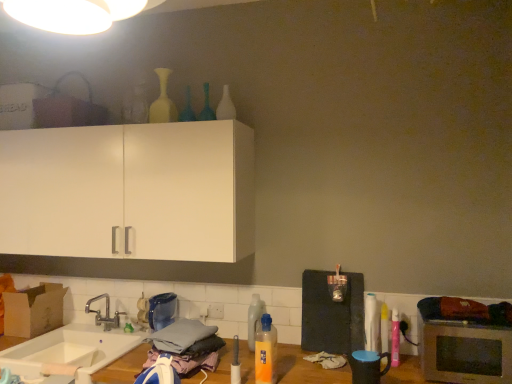
Question: Can you confirm if white ceramic sink at lower left is positioned to the right of matte white vase at upper center, the first bottle from the left?

Choices:
 (A) no
 (B) yes

Answer: (A)

Question: Is the position of white ceramic sink at lower left more distant than that of matte white vase at upper center, which ranks as the eighth bottle in right-to-left order?

Choices:
 (A) no
 (B) yes

Answer: (A)

Question: Does white ceramic sink at lower left have a greater height compared to matte white vase at upper center, the first bottle from the left?

Choices:
 (A) yes
 (B) no

Answer: (B)

Question: Is white ceramic sink at lower left oriented towards matte white vase at upper center, the first bottle from the left?

Choices:
 (A) no
 (B) yes

Answer: (A)

Question: Are white ceramic sink at lower left and matte white vase at upper center, the first bottle from the left, located far from each other?

Choices:
 (A) no
 (B) yes

Answer: (B)

Question: From the image's perspective, is pink plastic spray can at right, the 8th bottle when ordered from left to right, positioned above or below orange translucent bottle at lower center, which appears as the sixth bottle when viewed from the left?

Choices:
 (A) above
 (B) below

Answer: (B)

Question: Is pink plastic spray can at right, which is counted as the first bottle, starting from the right, to the left or to the right of orange translucent bottle at lower center, which appears as the sixth bottle when viewed from the left, in the image?

Choices:
 (A) right
 (B) left

Answer: (A)

Question: In terms of height, does pink plastic spray can at right, which is counted as the first bottle, starting from the right, look taller or shorter compared to orange translucent bottle at lower center, acting as the 3th bottle starting from the right?

Choices:
 (A) tall
 (B) short

Answer: (B)

Question: From a real-world perspective, is pink plastic spray can at right, which is counted as the first bottle, starting from the right, above or below orange translucent bottle at lower center, which appears as the sixth bottle when viewed from the left?

Choices:
 (A) below
 (B) above

Answer: (A)

Question: Is white glossy bottle at right, which is counted as the second bottle, starting from the right, taller or shorter than translucent glass bottle at upper center, positioned as the seventh bottle in right-to-left order?

Choices:
 (A) short
 (B) tall

Answer: (B)

Question: From the image's perspective, is white glossy bottle at right, which is counted as the second bottle, starting from the right, above or below translucent glass bottle at upper center, the 2th bottle viewed from the left?

Choices:
 (A) above
 (B) below

Answer: (B)

Question: Looking at the image, does white glossy bottle at right, which is counted as the second bottle, starting from the right, seem bigger or smaller compared to translucent glass bottle at upper center, positioned as the seventh bottle in right-to-left order?

Choices:
 (A) small
 (B) big

Answer: (B)

Question: Is white glossy bottle at right, which is counted as the second bottle, starting from the right, situated inside translucent glass bottle at upper center, the 2th bottle viewed from the left, or outside?

Choices:
 (A) outside
 (B) inside

Answer: (A)

Question: Is silver metallic microwave oven at lower right in front of or behind matte white vase at upper center, which ranks as the eighth bottle in right-to-left order, in the image?

Choices:
 (A) front
 (B) behind

Answer: (A)

Question: Considering the relative positions of silver metallic microwave oven at lower right and matte white vase at upper center, which ranks as the eighth bottle in right-to-left order, in the image provided, is silver metallic microwave oven at lower right to the left or to the right of matte white vase at upper center, which ranks as the eighth bottle in right-to-left order,?

Choices:
 (A) left
 (B) right

Answer: (B)